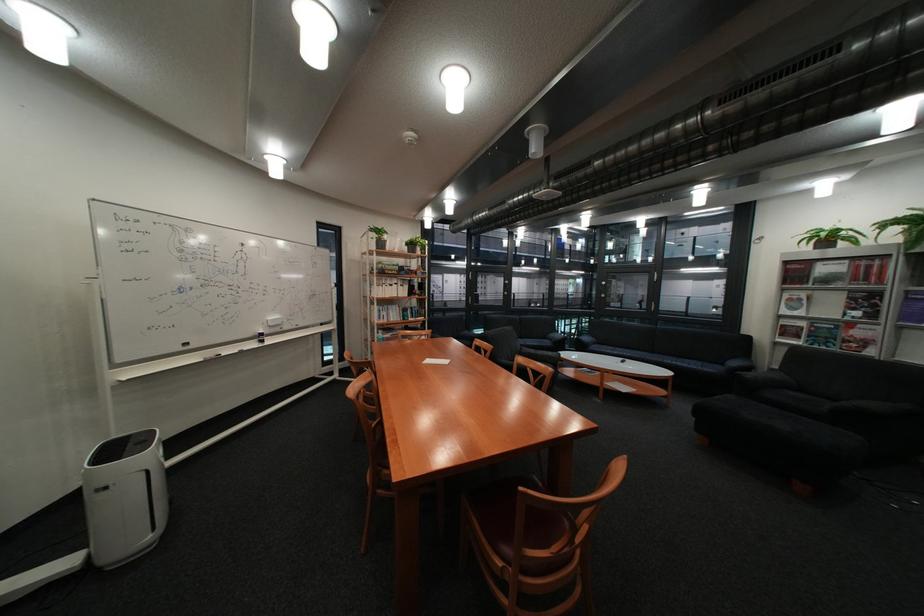
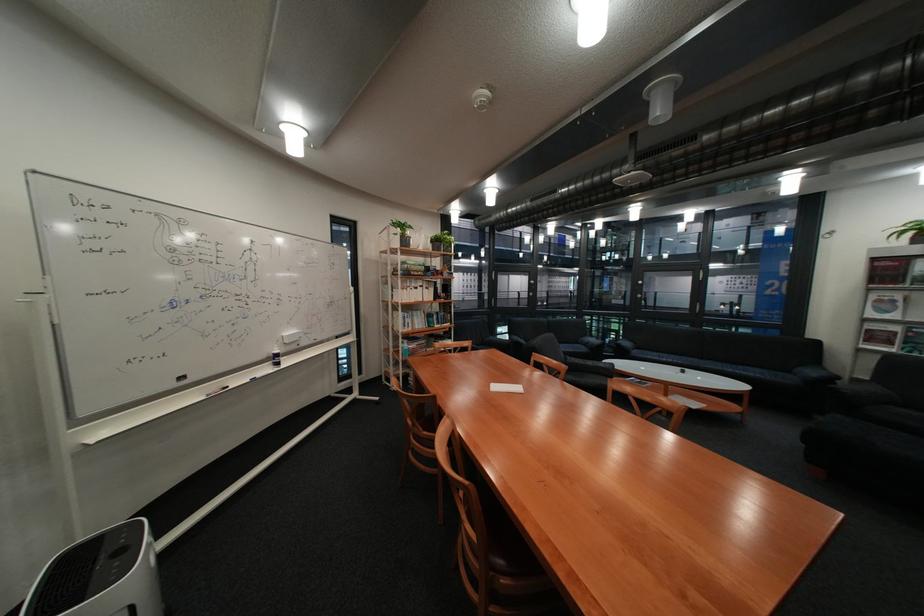
Question: Based on the continuous images, in which direction is the camera rotating? Reply with the corresponding letter.

Choices:
 (A) Left
 (B) Right
 (C) Up
 (D) Down

Answer: (B)